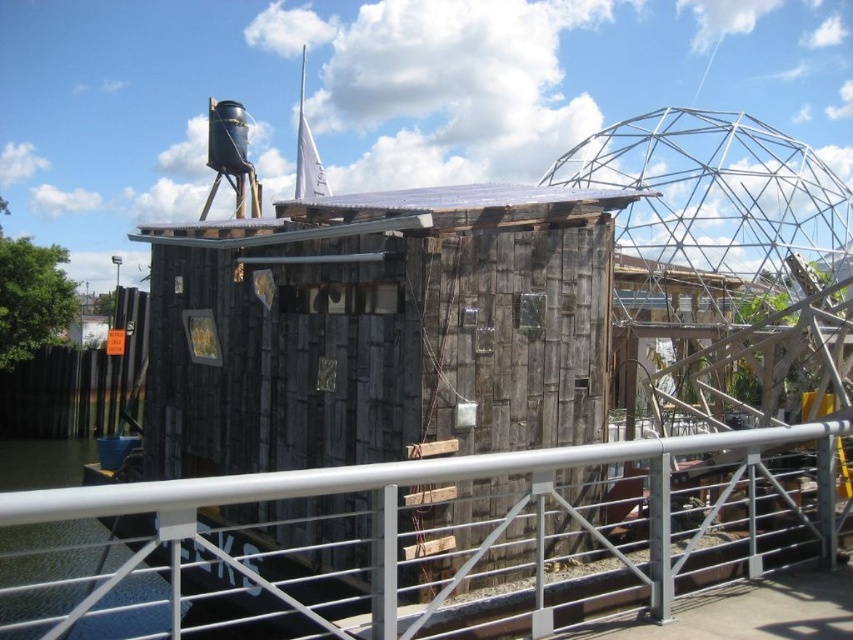
Question: Is the position of weathered wood hut at center more distant than that of silver metallic rail at lower center?

Choices:
 (A) yes
 (B) no

Answer: (A)

Question: Among these points, which one is nearest to the camera?

Choices:
 (A) (434, 454)
 (B) (289, 483)

Answer: (B)

Question: Which point is farther to the camera?

Choices:
 (A) (316, 380)
 (B) (648, 586)

Answer: (A)

Question: Does weathered wood hut at center have a lesser width compared to silver metallic rail at lower center?

Choices:
 (A) no
 (B) yes

Answer: (A)

Question: From the image, what is the correct spatial relationship of weathered wood hut at center in relation to silver metallic rail at lower center?

Choices:
 (A) left
 (B) right

Answer: (A)